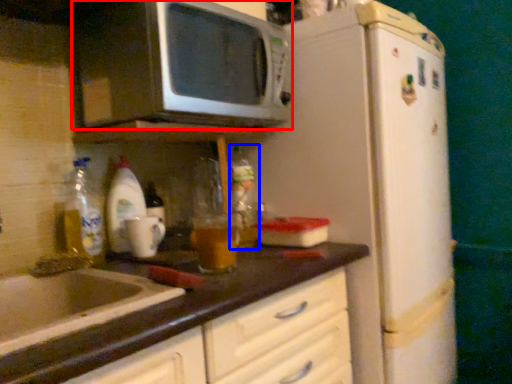
Question: Among these objects, which one is nearest to the camera, microwave oven (highlighted by a red box) or bottle (highlighted by a blue box)?

Choices:
 (A) microwave oven
 (B) bottle

Answer: (A)